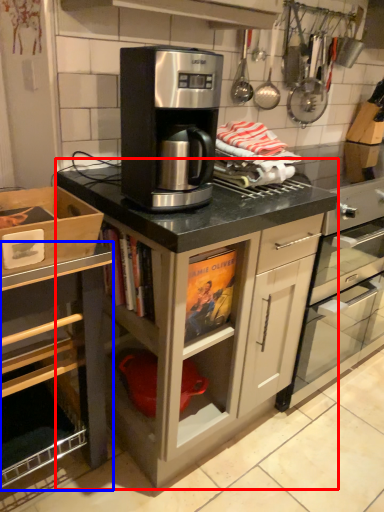
Question: Which object appears farthest to the camera in this image, cabinetry (highlighted by a red box) or cabinetry (highlighted by a blue box)?

Choices:
 (A) cabinetry
 (B) cabinetry

Answer: (A)